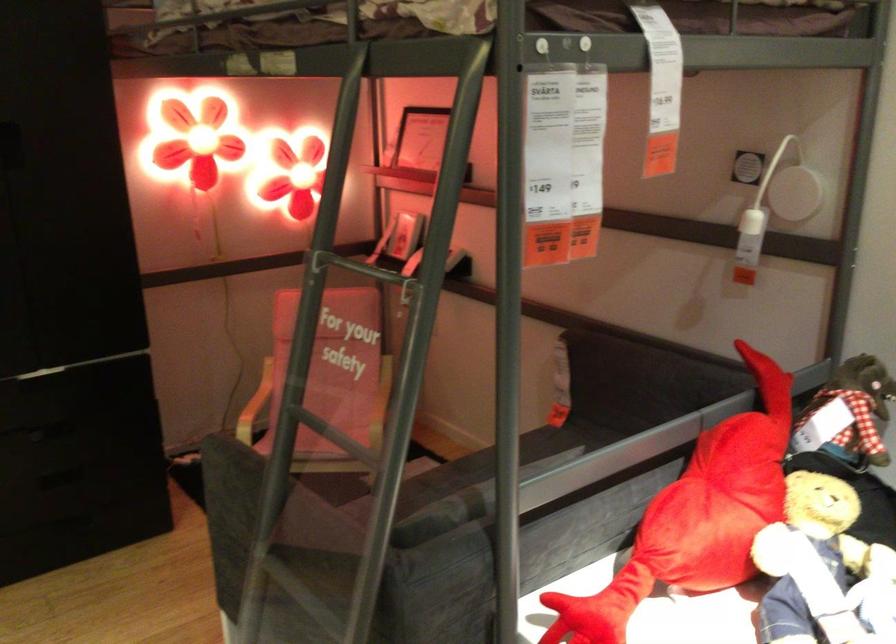
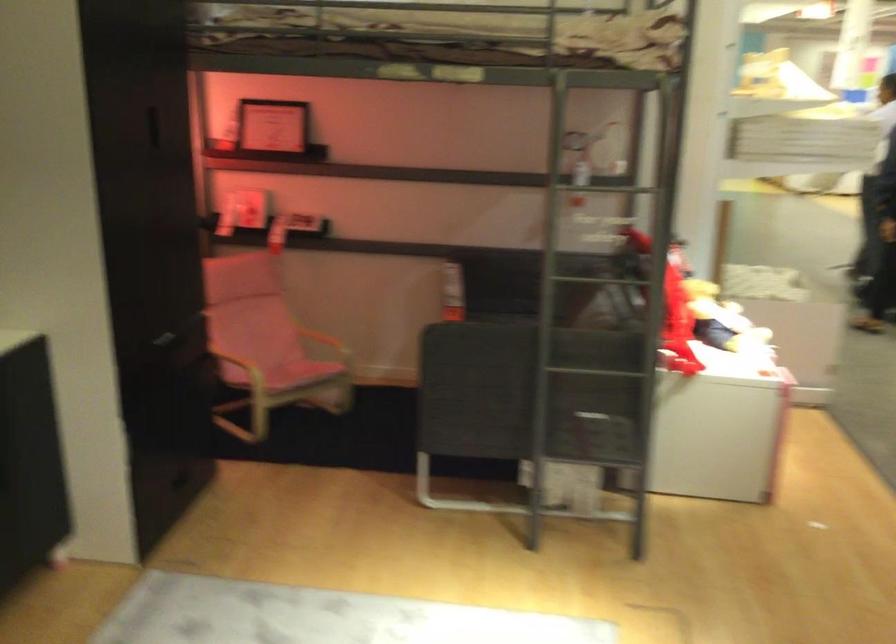
Question: I am providing you with two images of the same scene from different viewpoints. Which of the following objects are not visible in image2?

Choices:
 (A) cabinet slot handle
 (B) black telephone handset
 (C) chair armrest
 (D) teddy bear toy

Answer: (D)